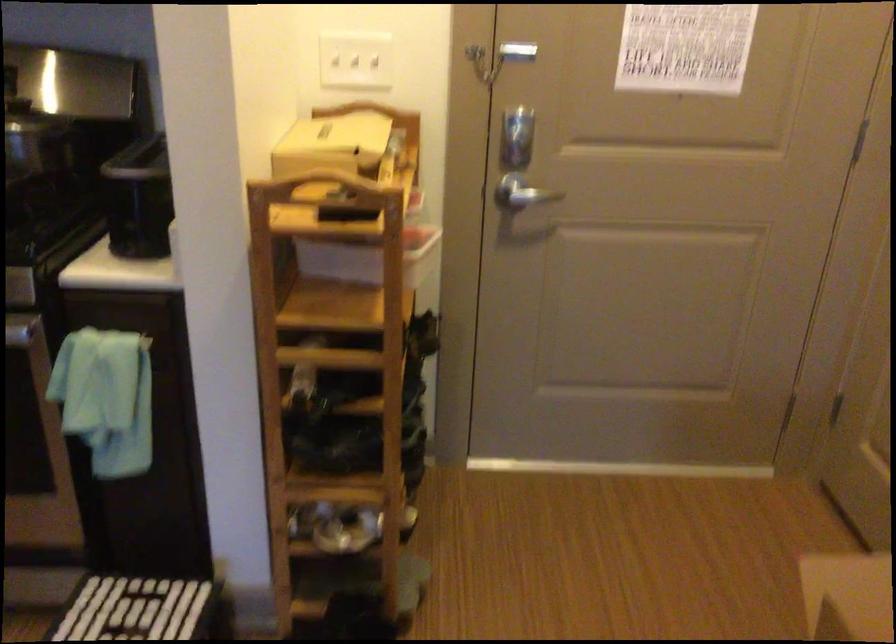
This screenshot has width=896, height=644. Describe the element at coordinates (521, 193) in the screenshot. I see `a silver door handle` at that location.